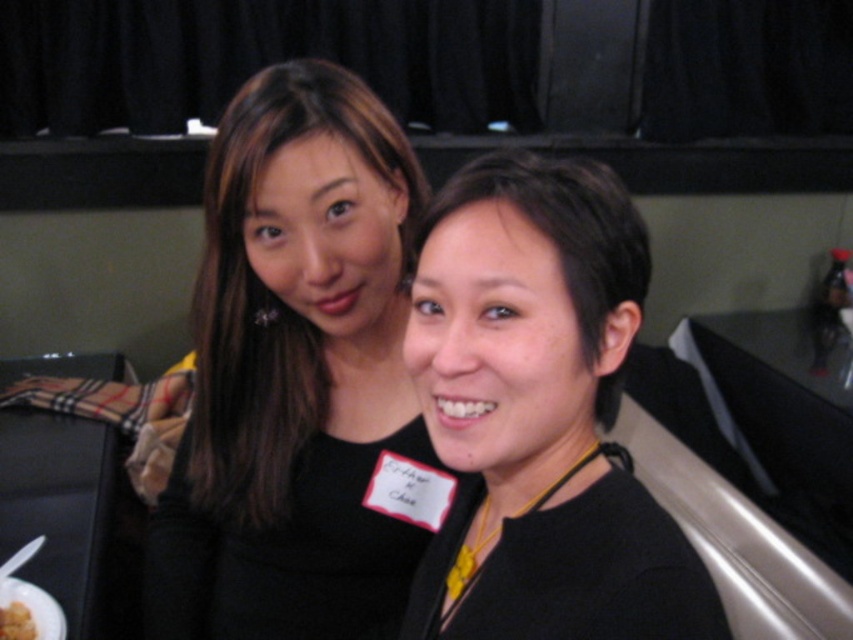
The height and width of the screenshot is (640, 853). What do you see at coordinates (294, 372) in the screenshot?
I see `black matte dress at center` at bounding box center [294, 372].

The image size is (853, 640). What are the coordinates of `black matte dress at center` in the screenshot? It's located at (294, 372).

Can you confirm if black matte dress at center is positioned to the left of yellow matte food at lower left?

In fact, black matte dress at center is to the right of yellow matte food at lower left.

How much distance is there between black matte dress at center and yellow matte food at lower left?

black matte dress at center and yellow matte food at lower left are 18.52 inches apart.

The width and height of the screenshot is (853, 640). In order to click on black matte dress at center in this screenshot , I will do `click(294, 372)`.

At what (x,y) coordinates should I click in order to perform the action: click on black matte dress at center. Please return your answer as a coordinate pair (x, y). Image resolution: width=853 pixels, height=640 pixels. Looking at the image, I should click on (294, 372).

Who is more forward, (286, 284) or (26, 598)?

Point (286, 284) is more forward.

Can you confirm if black matte dress at center is thinner than white matte plate at lower left?

Incorrect, black matte dress at center's width is not less than white matte plate at lower left's.

The width and height of the screenshot is (853, 640). Find the location of `black matte dress at center`. black matte dress at center is located at coordinates (294, 372).